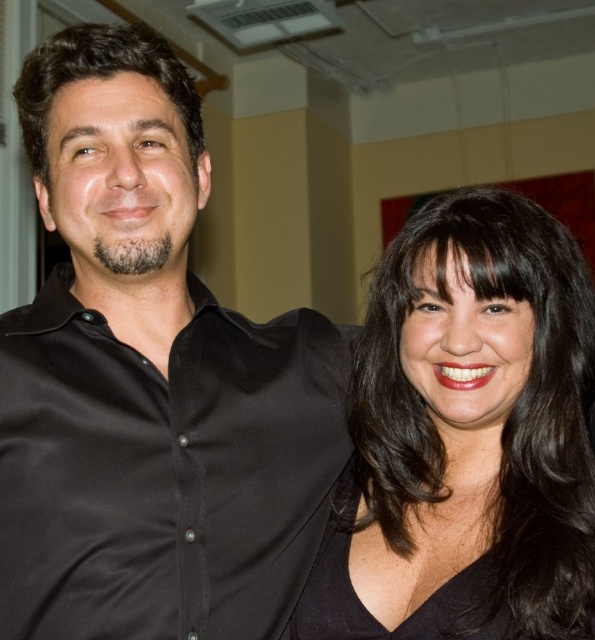
From the picture: You are a photographer setting up for a group photo. You notice the matte black shirt at center and the black matte hair at right in your frame. Which object should you adjust to ensure both are fully visible in the photo?

The matte black shirt at center is much taller than the black matte hair at right, so you should adjust the matte black shirt at center to ensure both are fully visible in the photo.

You are at a party and want to introduce yourself to the person wearing the matte black shirt at center and the black matte hair at right. Which object is closer to the left side of the image?

The matte black shirt at center is closer to the left side of the image because it is positioned on the left side of the black matte hair at right.